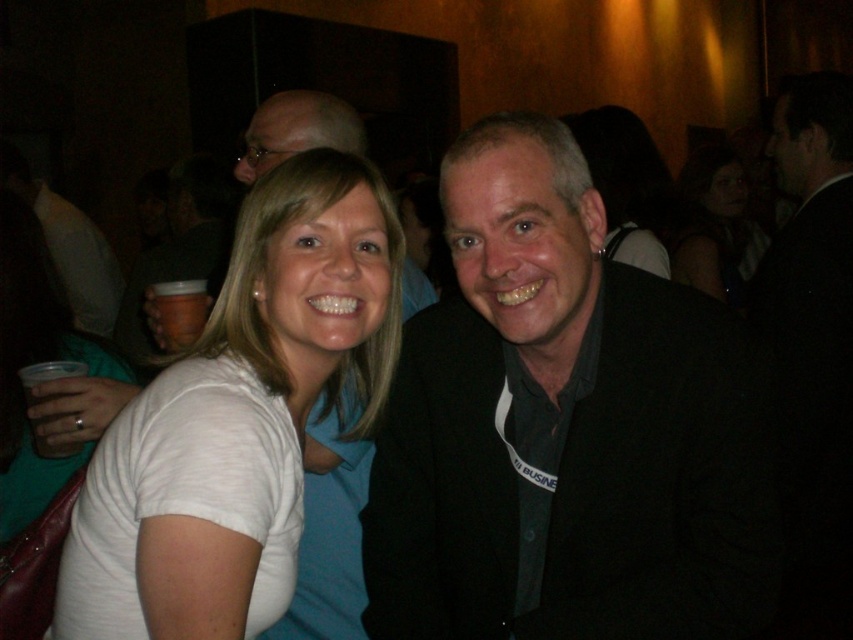
You are at a party and need to grab the brown paper cup at left without touching the black suit at right. Can you reach it safely?

The black suit at right is to the right of the brown paper cup at left, so you can safely reach the brown paper cup at left without touching the black suit at right.

You are a photographer adjusting the camera settings for a group photo. The scene includes a smooth skin face at upper right and a matte black jacket at center. Which object should you focus on first if you want to ensure both are in focus, considering their sizes?

The smooth skin face at upper right is not as tall as the matte black jacket at center, so you should focus on the matte black jacket at center first since it is larger and requires more precise focus to ensure both are in focus.